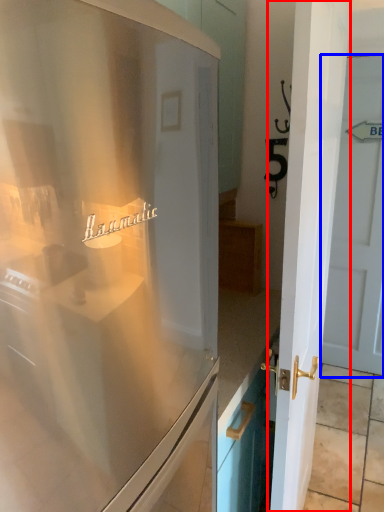
Question: Which object is further to the camera taking this photo, door (highlighted by a red box) or door (highlighted by a blue box)?

Choices:
 (A) door
 (B) door

Answer: (B)